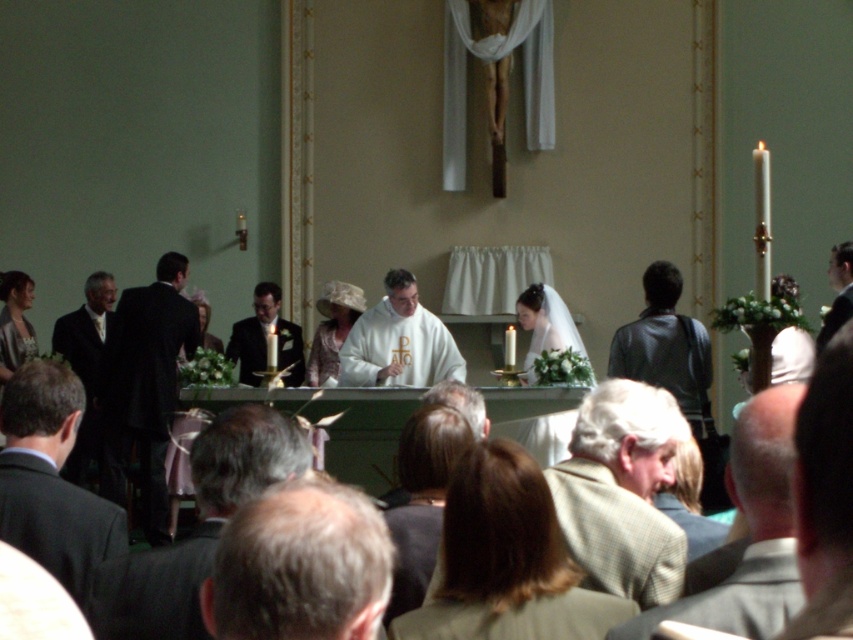
You are a photographer at the wedding ceremony. You want to capture a photo of the light beige lace dress at center and the matte white dress at left. Which dress is closer to the camera?

The light beige lace dress at center is closer to the camera because it is in front of the matte white dress at left.

You are attending a wedding and see the light beige lace dress at center and the matte white dress at left. Which one is positioned to the right side of the other?

The light beige lace dress at center is positioned to the right of the matte white dress at left.